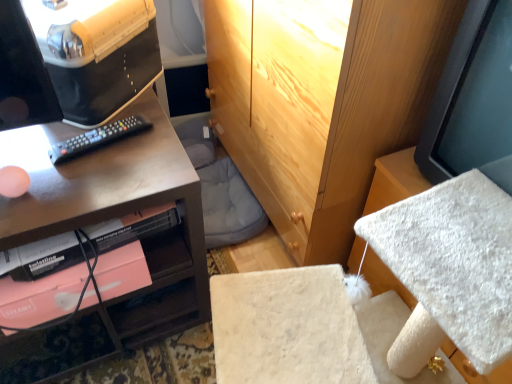
Where is `black plastic remote at left`? This screenshot has height=384, width=512. black plastic remote at left is located at coordinates (97, 138).

What is the approximate width of black plastic remote at left?

The width of black plastic remote at left is 3.59 inches.

This screenshot has width=512, height=384. Describe the element at coordinates (473, 101) in the screenshot. I see `matte black monitor at right` at that location.

Locate an element on the screen. The image size is (512, 384). matte black desk at left is located at coordinates (119, 214).

Looking at this image, measure the distance between point [75,47] and camera.

82.30 centimeters.

This screenshot has width=512, height=384. Identify the location of matte black monitor at upper left. (96, 53).

Locate an element on the screen. The image size is (512, 384). black plastic remote at left is located at coordinates (97, 138).

From a real-world perspective, is matte black monitor at right physically below matte black monitor at upper left?

Incorrect, from a real-world perspective, matte black monitor at right is higher than matte black monitor at upper left.

From the picture: Are matte black monitor at right and matte black monitor at upper left beside each other?

No, matte black monitor at right is not next to matte black monitor at upper left.

Is point (455, 73) closer or farther from the camera than point (139, 42)?

Point (455, 73) appears to be closer to the viewer than point (139, 42).

From the image's perspective, relative to matte black monitor at upper left, is matte black monitor at right above or below?

From the image's perspective, matte black monitor at right appears below matte black monitor at upper left.

Identify the location of computer monitor lying in front of the black plastic remote at left. (473, 101).

From the image's perspective, who appears lower, matte black monitor at right or black plastic remote at left?

black plastic remote at left, from the image's perspective.

Considering the sizes of objects matte black monitor at right and black plastic remote at left in the image provided, who is shorter, matte black monitor at right or black plastic remote at left?

black plastic remote at left.

Based on their sizes in the image, would you say matte black desk at left is bigger or smaller than black plastic remote at left?

In the image, matte black desk at left appears to be larger than black plastic remote at left.

I want to click on remote that appears on the right of matte black desk at left, so click(97, 138).

Is matte black desk at left in contact with black plastic remote at left?

matte black desk at left and black plastic remote at left are not in contact.

Considering the positions of objects matte black desk at left and black plastic remote at left in the image provided, who is behind, matte black desk at left or black plastic remote at left?

Answer: black plastic remote at left is further away from the camera.

Looking at this image, can you confirm if matte black desk at left is taller than matte black monitor at upper left?

Yes, matte black desk at left is taller than matte black monitor at upper left.

Can you tell me how much matte black desk at left and matte black monitor at upper left differ in facing direction?

They differ by 44 degrees in their facing directions.

Does point (44, 186) come behind point (148, 8)?

No, it is not.

Is matte black desk at left at the left side of matte black monitor at upper left?

Yes, matte black desk at left is to the left of matte black monitor at upper left.

Do you think black plastic remote at left is within matte black monitor at right, or outside of it?

black plastic remote at left lies outside matte black monitor at right.

Looking at this image, is black plastic remote at left oriented towards matte black monitor at right?

No, black plastic remote at left does not turn towards matte black monitor at right.

Between black plastic remote at left and matte black monitor at right, which one is positioned in front?

Positioned in front is matte black monitor at right.

Identify the location of desktop computer above the black plastic remote at left (from the image's perspective). (96, 53).

From a real-world perspective, which object stands above the other?

From a 3D spatial view, matte black monitor at upper left is above.

Is black plastic remote at left surrounding matte black monitor at upper left?

No, matte black monitor at upper left is located outside of black plastic remote at left.

Considering the sizes of black plastic remote at left and matte black monitor at upper left in the image, is black plastic remote at left bigger or smaller than matte black monitor at upper left?

In the image, black plastic remote at left appears to be smaller than matte black monitor at upper left.

Is black plastic remote at left directly adjacent to matte black desk at left?

black plastic remote at left is not next to matte black desk at left, and they're not touching.

In the image, is black plastic remote at left on the left side or the right side of matte black desk at left?

black plastic remote at left is to the right of matte black desk at left.

Between black plastic remote at left and matte black desk at left, which one has smaller size?

black plastic remote at left.

Does black plastic remote at left turn towards matte black desk at left?

Yes, black plastic remote at left is aimed at matte black desk at left.

You are a GUI agent. You are given a task and a screenshot of the screen. Output one action in this format:
    pyautogui.click(x=<x>, y=<y>)
    Task: Click on the desktop computer below the matte black monitor at right (from a real-world perspective)
    
    Given the screenshot: What is the action you would take?
    pyautogui.click(x=96, y=53)

The width and height of the screenshot is (512, 384). There is a black plastic remote at left. What are the coordinates of `computer monitor above it (from a real-world perspective)` in the screenshot? It's located at (473, 101).

When comparing their distances from matte black monitor at upper left, does matte black desk at left or matte black monitor at right seem closer?

matte black desk at left lies closer to matte black monitor at upper left than the other object.

Based on their spatial positions, is black plastic remote at left or matte black monitor at right further from matte black monitor at upper left?

Based on the image, matte black monitor at right appears to be further to matte black monitor at upper left.

When comparing their distances from matte black monitor at upper left, does matte black monitor at right or matte black desk at left seem further?

Based on the image, matte black monitor at right appears to be further to matte black monitor at upper left.

Estimate the real-world distances between objects in this image. Which object is closer to matte black monitor at right, matte black desk at left or matte black monitor at upper left?

matte black desk at left.

Estimate the real-world distances between objects in this image. Which object is further from black plastic remote at left, matte black desk at left or matte black monitor at right?

matte black monitor at right is further to black plastic remote at left.

From the image, which object appears to be nearer to matte black monitor at upper left, matte black monitor at right or black plastic remote at left?

black plastic remote at left lies closer to matte black monitor at upper left than the other object.

Which object lies nearer to the anchor point black plastic remote at left, matte black monitor at right or matte black desk at left?

Among the two, matte black desk at left is located nearer to black plastic remote at left.

Estimate the real-world distances between objects in this image. Which object is closer to matte black desk at left, black plastic remote at left or matte black monitor at upper left?

The object closer to matte black desk at left is matte black monitor at upper left.

Where is `remote between matte black monitor at upper left and matte black monitor at right from left to right`? The height and width of the screenshot is (384, 512). remote between matte black monitor at upper left and matte black monitor at right from left to right is located at coordinates (97, 138).

Identify the location of desktop computer situated between matte black desk at left and matte black monitor at right from left to right. The image size is (512, 384). (96, 53).

Find the location of a particular element. The width and height of the screenshot is (512, 384). remote situated between matte black desk at left and matte black monitor at right from left to right is located at coordinates (97, 138).

You are a GUI agent. You are given a task and a screenshot of the screen. Output one action in this format:
    pyautogui.click(x=<x>, y=<y>)
    Task: Click on the remote between matte black monitor at upper left and matte black desk at left in the vertical direction
    The image size is (512, 384).
    Given the screenshot: What is the action you would take?
    pyautogui.click(x=97, y=138)